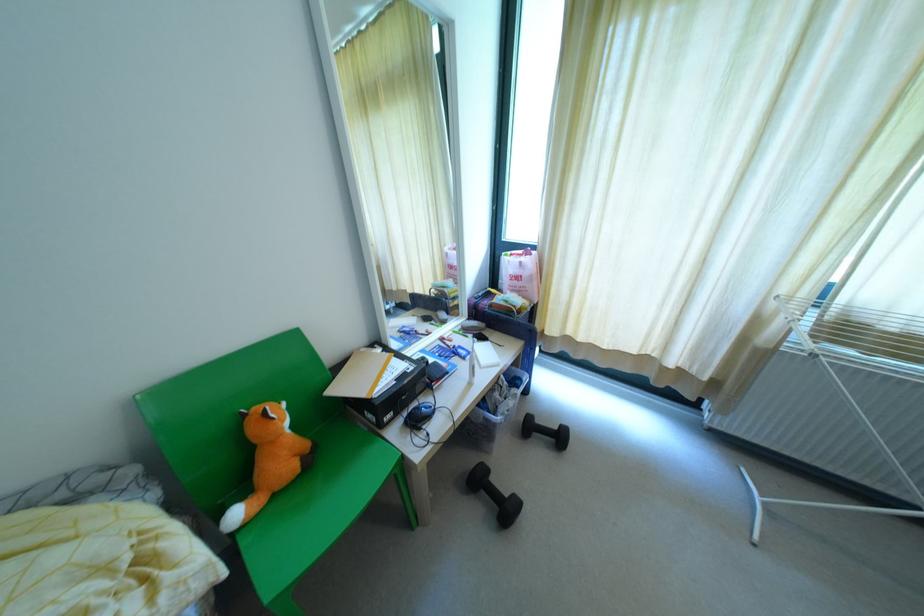
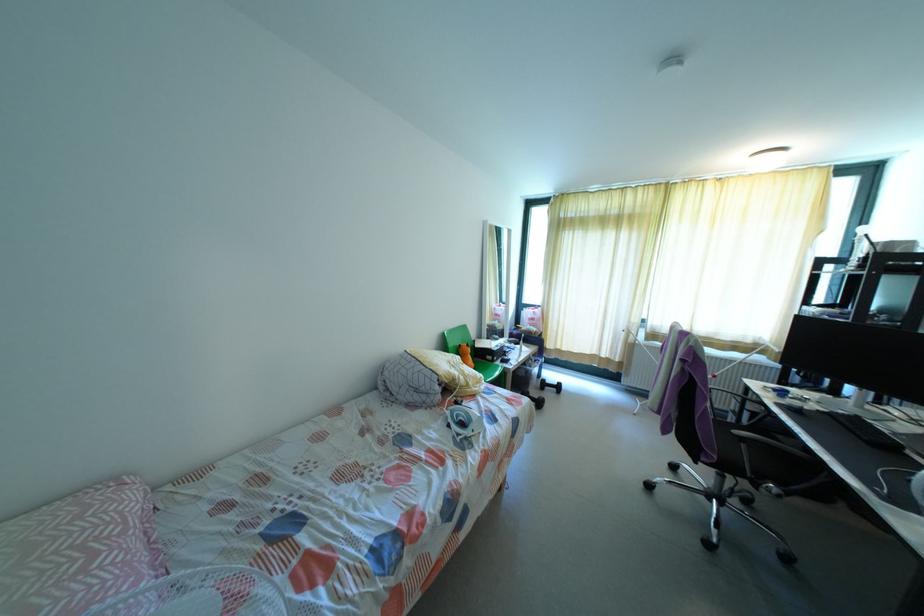
In a continuous first-person perspective shot, in which direction is the camera moving?

The cameraman moved toward left, backward.